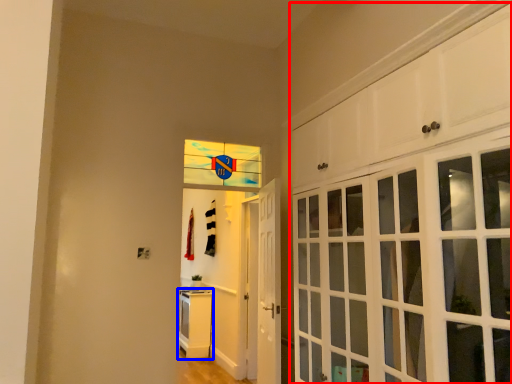
Question: Which of the following is the closest to the observer, cabinetry (highlighted by a red box) or cabinetry (highlighted by a blue box)?

Choices:
 (A) cabinetry
 (B) cabinetry

Answer: (A)